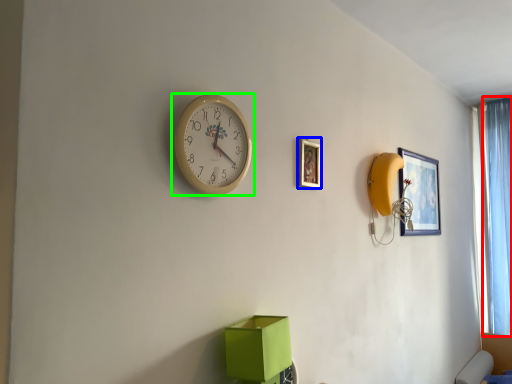
Question: Which object is the closest to the curtain (highlighted by a red box)? Choose among these: picture frame (highlighted by a blue box) or wall clock (highlighted by a green box).

Choices:
 (A) picture frame
 (B) wall clock

Answer: (A)